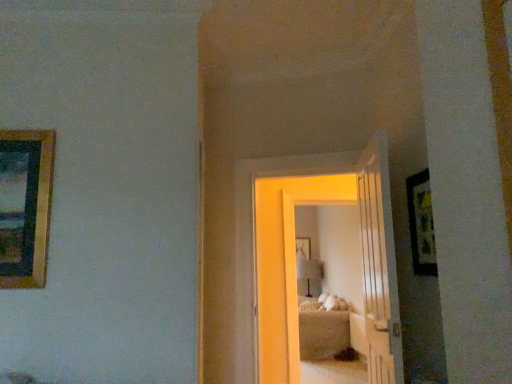
The height and width of the screenshot is (384, 512). I want to click on matte white lamp at center, so click(x=309, y=272).

The image size is (512, 384). What do you see at coordinates (303, 248) in the screenshot? I see `wooden picture frame at center, which ranks as the third picture frame in top-to-bottom order` at bounding box center [303, 248].

This screenshot has width=512, height=384. Find the location of `beige fabric bed at center`. beige fabric bed at center is located at coordinates (321, 331).

What do you see at coordinates (421, 224) in the screenshot?
I see `wooden framed picture at right, which ranks as the second picture frame in bottom-to-top order` at bounding box center [421, 224].

In order to face gold-framed picture at left, positioned as the 1th picture frame in left-to-right order, should I rotate leftwards or rightwards?

Turn left approximately 28.943 degrees to face it.

Describe the element at coordinates (295, 258) in the screenshot. This screenshot has width=512, height=384. I see `white glossy door at center, the first door when ordered from left to right` at that location.

Locate an element on the screen. The height and width of the screenshot is (384, 512). matte white lamp at center is located at coordinates (309, 272).

Is wooden picture frame at center, the 1th picture frame from the right, oriented towards gold-framed picture at left, the second picture frame in the front-to-back sequence?

No.

Considering the sizes of objects wooden picture frame at center, the 1th picture frame from the right, and gold-framed picture at left, the third picture frame when ordered from bottom to top, in the image provided, who is wider, wooden picture frame at center, the 1th picture frame from the right, or gold-framed picture at left, the third picture frame when ordered from bottom to top,?

gold-framed picture at left, the third picture frame when ordered from bottom to top, is wider.

Can you confirm if wooden picture frame at center, placed as the first picture frame when sorted from bottom to top, is bigger than gold-framed picture at left, which is the 1th picture frame from top to bottom?

No, wooden picture frame at center, placed as the first picture frame when sorted from bottom to top, is not bigger than gold-framed picture at left, which is the 1th picture frame from top to bottom.

Identify the location of picture frame positioned vertically above the gold-framed picture at left, the third picture frame when ordered from bottom to top (from a real-world perspective). (303, 248).

How many degrees apart are the facing directions of white glossy door at center, placed as the 2th door when sorted from right to left, and beige fabric bed at center?

70.2 degrees separate the facing orientations of white glossy door at center, placed as the 2th door when sorted from right to left, and beige fabric bed at center.

From the image's perspective, is white glossy door at center, the first door when ordered from left to right, below beige fabric bed at center?

No, from the image's perspective, white glossy door at center, the first door when ordered from left to right, is not beneath beige fabric bed at center.

Considering the sizes of white glossy door at center, the first door when ordered from left to right, and beige fabric bed at center in the image, is white glossy door at center, the first door when ordered from left to right, taller or shorter than beige fabric bed at center?

Considering their sizes, white glossy door at center, the first door when ordered from left to right, has more height than beige fabric bed at center.

Is white glossy door at center, the first door when ordered from left to right, further to the viewer compared to beige fabric bed at center?

That is False.

Can you confirm if wooden picture frame at center, marked as the 1th picture frame in a back-to-front arrangement, is positioned to the left of wooden framed picture at right, which ranks as the third picture frame in back-to-front order?

No.

How many degrees apart are the facing directions of wooden picture frame at center, acting as the 3th picture frame starting from the left, and wooden framed picture at right, which ranks as the third picture frame in back-to-front order?

The angle between the facing direction of wooden picture frame at center, acting as the 3th picture frame starting from the left, and the facing direction of wooden framed picture at right, which ranks as the third picture frame in back-to-front order, is 90.3 degrees.

Is wooden picture frame at center, which ranks as the third picture frame in top-to-bottom order, spatially inside wooden framed picture at right, acting as the second picture frame starting from the top, or outside of it?

wooden picture frame at center, which ranks as the third picture frame in top-to-bottom order, exists outside the volume of wooden framed picture at right, acting as the second picture frame starting from the top.

Could you measure the distance between wooden picture frame at center, acting as the 3th picture frame starting from the front, and wooden framed picture at right, the second picture frame viewed from the right?

wooden picture frame at center, acting as the 3th picture frame starting from the front, is 5.63 meters away from wooden framed picture at right, the second picture frame viewed from the right.

How far apart are white glossy door at center, the first door when ordered from left to right, and gold-framed picture at left, the second picture frame in the front-to-back sequence?

white glossy door at center, the first door when ordered from left to right, is 5.00 feet from gold-framed picture at left, the second picture frame in the front-to-back sequence.

Considering the positions of points (392, 339) and (40, 134), is point (392, 339) farther from camera compared to point (40, 134)?

No, (392, 339) is closer to viewer.

Does white glossy door at center, the first door when ordered from left to right, appear on the right side of gold-framed picture at left, marked as the third picture frame in a right-to-left arrangement?

Yes.

From a real-world perspective, is white glossy door at center, placed as the 2th door when sorted from right to left, physically below gold-framed picture at left, placed as the second picture frame when sorted from back to front?

Correct, in the physical world, white glossy door at center, placed as the 2th door when sorted from right to left, is lower than gold-framed picture at left, placed as the second picture frame when sorted from back to front.

Based on the photo, is beige fabric bed at center looking in the opposite direction of white glossy door at center, placed as the 2th door when sorted from right to left?

beige fabric bed at center does not have its back to white glossy door at center, placed as the 2th door when sorted from right to left.

Is beige fabric bed at center thinner than white glossy door at center, the first door when ordered from left to right?

In fact, beige fabric bed at center might be wider than white glossy door at center, the first door when ordered from left to right.

Looking at this image, considering the sizes of beige fabric bed at center and white glossy door at center, the first door when ordered from left to right, in the image, is beige fabric bed at center taller or shorter than white glossy door at center, the first door when ordered from left to right,?

In the image, beige fabric bed at center appears to be shorter than white glossy door at center, the first door when ordered from left to right.

Is beige fabric bed at center surrounding white glossy door at center, the first door when ordered from left to right?

Definitely not — white glossy door at center, the first door when ordered from left to right, is not inside beige fabric bed at center.

In terms of size, does beige fabric bed at center appear bigger or smaller than wooden picture frame at center, acting as the 3th picture frame starting from the front?

beige fabric bed at center is bigger than wooden picture frame at center, acting as the 3th picture frame starting from the front.

Are beige fabric bed at center and wooden picture frame at center, marked as the 1th picture frame in a back-to-front arrangement, located far from each other?

Yes, beige fabric bed at center and wooden picture frame at center, marked as the 1th picture frame in a back-to-front arrangement, are quite far apart.

At what (x,y) coordinates should I click in order to perform the action: click on bed in front of the wooden picture frame at center, placed as the first picture frame when sorted from bottom to top. Please return your answer as a coordinate pair (x, y). This screenshot has width=512, height=384. Looking at the image, I should click on (321, 331).

From the image's perspective, is beige fabric bed at center positioned above or below wooden picture frame at center, acting as the 3th picture frame starting from the left?

Clearly, from the image's perspective, beige fabric bed at center is below wooden picture frame at center, acting as the 3th picture frame starting from the left.

Where is `the 2nd door above when counting from the wooden picture frame at center, acting as the 3th picture frame starting from the left (from the image's perspective)`? the 2nd door above when counting from the wooden picture frame at center, acting as the 3th picture frame starting from the left (from the image's perspective) is located at coordinates (379, 265).

Can you tell me how much wooden picture frame at center, the 1th picture frame from the right, and white wooden door at center, the 2th door positioned from the left, differ in facing direction?

The angular difference between wooden picture frame at center, the 1th picture frame from the right, and white wooden door at center, the 2th door positioned from the left, is 100 degrees.

From the image's perspective, does wooden picture frame at center, placed as the first picture frame when sorted from bottom to top, appear lower than white wooden door at center, arranged as the first door when viewed from the right?

Yes.

Does wooden picture frame at center, acting as the 3th picture frame starting from the left, turn towards white wooden door at center, the 2th door positioned from the left?

Yes, wooden picture frame at center, acting as the 3th picture frame starting from the left, is oriented towards white wooden door at center, the 2th door positioned from the left.

From a real-world perspective, count 1st picture frames downward from the wooden picture frame at center, placed as the first picture frame when sorted from bottom to top, and point to it. Please provide its 2D coordinates.

[(25, 206)]

I want to click on the 2nd door to the left when counting from the beige fabric bed at center, so click(x=295, y=258).

Looking at the image, which one is located further to white glossy door at center, the first door when ordered from left to right, wooden picture frame at center, acting as the 3th picture frame starting from the front, or wooden framed picture at right, acting as the second picture frame starting from the top?

wooden picture frame at center, acting as the 3th picture frame starting from the front, lies further to white glossy door at center, the first door when ordered from left to right, than the other object.

Considering their positions, is gold-framed picture at left, marked as the third picture frame in a right-to-left arrangement, positioned further to wooden picture frame at center, acting as the 3th picture frame starting from the left, than white glossy door at center, placed as the 2th door when sorted from right to left?

gold-framed picture at left, marked as the third picture frame in a right-to-left arrangement.

Looking at the image, which one is located further to matte white lamp at center, wooden picture frame at center, which ranks as the third picture frame in top-to-bottom order, or wooden framed picture at right, which ranks as the third picture frame in back-to-front order?

wooden framed picture at right, which ranks as the third picture frame in back-to-front order, is positioned further to the anchor matte white lamp at center.

Estimate the real-world distances between objects in this image. Which object is closer to wooden framed picture at right, arranged as the 2th picture frame when viewed from the left, white wooden door at center, arranged as the first door when viewed from the right, or white glossy door at center, placed as the 2th door when sorted from right to left?

white wooden door at center, arranged as the first door when viewed from the right, is closer to wooden framed picture at right, arranged as the 2th picture frame when viewed from the left.

From the image, which object appears to be nearer to wooden picture frame at center, which ranks as the third picture frame in top-to-bottom order, matte white lamp at center or wooden framed picture at right, which ranks as the second picture frame in bottom-to-top order?

matte white lamp at center lies closer to wooden picture frame at center, which ranks as the third picture frame in top-to-bottom order, than the other object.

Based on their spatial positions, is wooden picture frame at center, the 1th picture frame from the right, or matte white lamp at center closer to white wooden door at center, the 2th door positioned from the left?

The object closer to white wooden door at center, the 2th door positioned from the left, is matte white lamp at center.

Looking at the image, which one is located further to white glossy door at center, placed as the 2th door when sorted from right to left, gold-framed picture at left, which is the 1th picture frame from top to bottom, or beige fabric bed at center?

Among the two, beige fabric bed at center is located further to white glossy door at center, placed as the 2th door when sorted from right to left.

From the picture: Based on their spatial positions, is white wooden door at center, arranged as the first door when viewed from the right, or wooden framed picture at right, acting as the second picture frame starting from the top, closer to gold-framed picture at left, which is the 1th picture frame from top to bottom?

white wooden door at center, arranged as the first door when viewed from the right, lies closer to gold-framed picture at left, which is the 1th picture frame from top to bottom, than the other object.

Find the location of a particular element. The height and width of the screenshot is (384, 512). door between gold-framed picture at left, which is the 1th picture frame from top to bottom, and white wooden door at center, arranged as the first door when viewed from the right is located at coordinates (295, 258).

Locate an element on the screen. bed located between white glossy door at center, placed as the 2th door when sorted from right to left, and wooden picture frame at center, acting as the 3th picture frame starting from the front, in the depth direction is located at coordinates [321, 331].

Where is `bed positioned between white glossy door at center, the first door when ordered from left to right, and matte white lamp at center from near to far`? The image size is (512, 384). bed positioned between white glossy door at center, the first door when ordered from left to right, and matte white lamp at center from near to far is located at coordinates (321, 331).

The width and height of the screenshot is (512, 384). In order to click on door between wooden framed picture at right, which ranks as the third picture frame in back-to-front order, and beige fabric bed at center in the front-back direction in this screenshot , I will do `click(295, 258)`.